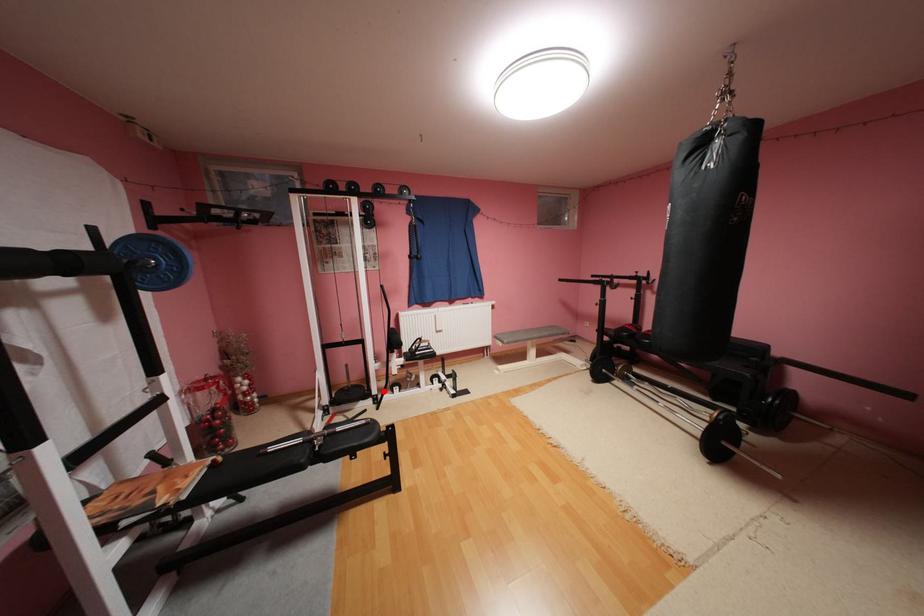
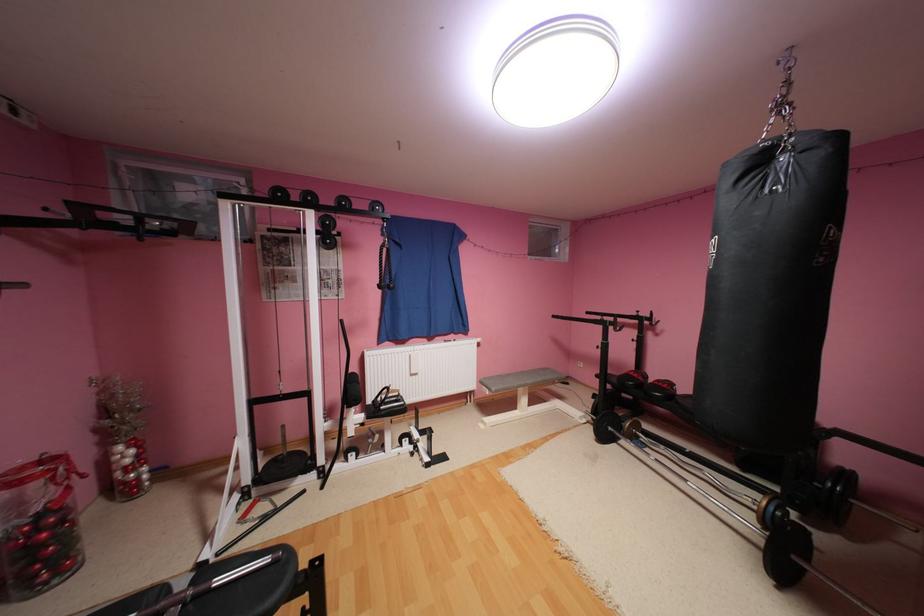
Question: I am providing you with two images of the same scene from different viewpoints. Given a red point in image1, look at the same physical point in image2. Is it:

Choices:
 (A) Closer to the viewpoint
 (B) Farther from the viewpoint

Answer: (A)